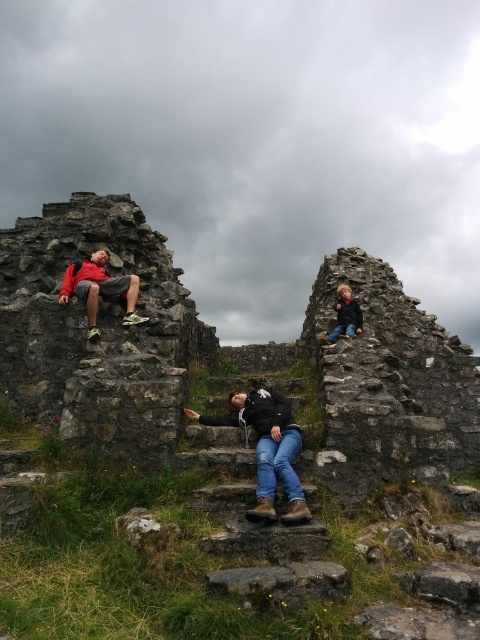
You are standing in front of the stone structure and see the rusty stone wall at upper left and the matte black shorts at left. Which object is positioned more to the left side?

The matte black shorts at left are positioned more to the left side because the rusty stone wall at upper left is to the right of matte black shorts at left.

You are standing in front of the ruins and want to take a photo of the rusty stone wall at upper left. Considering the distance, do you think you can capture the entire wall in one frame without moving your camera?

The rusty stone wall at upper left is 74.90 feet away from you. Since this distance is quite far, it might be challenging to capture the entire wall in one frame without moving your camera, depending on your lens and camera angle.